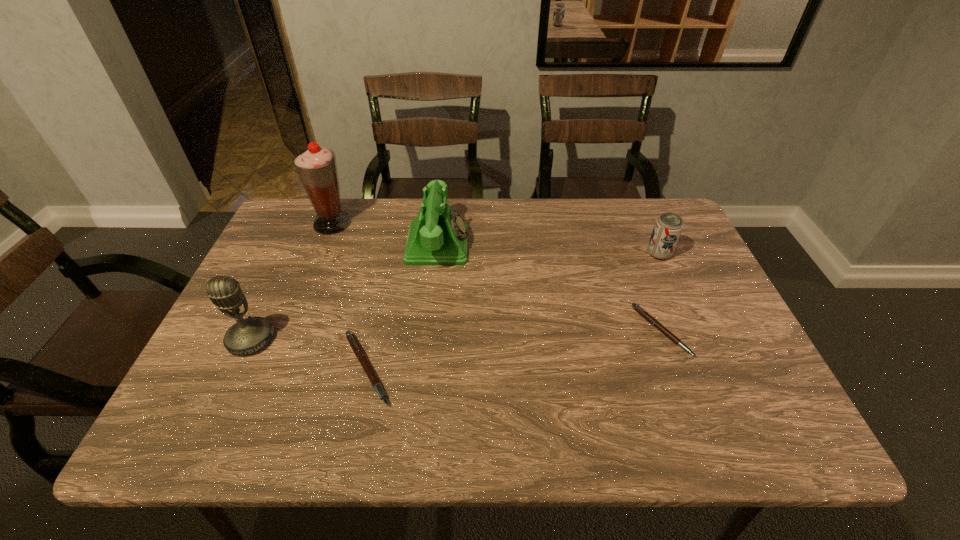
Find the location of a particular element. This screenshot has width=960, height=540. vacant space in between the telephone and the microphone is located at coordinates (345, 292).

The width and height of the screenshot is (960, 540). I want to click on free space between the microphone and the smoothie, so click(x=292, y=281).

The height and width of the screenshot is (540, 960). Identify the location of vacant point located between the third tallest object and the shorter pen. (549, 288).

At what (x,y) coordinates should I click in order to perform the action: click on free point between the taller pen and the third shortest object. Please return your answer as a coordinate pair (x, y). Looking at the image, I should click on (513, 311).

Locate an element on the screen. The image size is (960, 540). empty space that is in between the beer can and the microphone is located at coordinates (455, 296).

At what (x,y) coordinates should I click in order to perform the action: click on vacant space that is in between the taller pen and the microphone. Please return your answer as a coordinate pair (x, y). Looking at the image, I should click on (309, 354).

This screenshot has height=540, width=960. I want to click on free point between the taller pen and the microphone, so click(x=309, y=354).

Where is `empty space that is in between the left pen and the telephone`? The image size is (960, 540). empty space that is in between the left pen and the telephone is located at coordinates (402, 307).

Identify the location of empty space between the microphone and the fifth tallest object. The height and width of the screenshot is (540, 960). (309, 354).

Identify which object is the closest to the microphone. Please provide its 2D coordinates. Your answer should be formatted as a tuple, i.e. [(x, y)], where the tuple contains the x and y coordinates of a point satisfying the conditions above.

[(358, 351)]